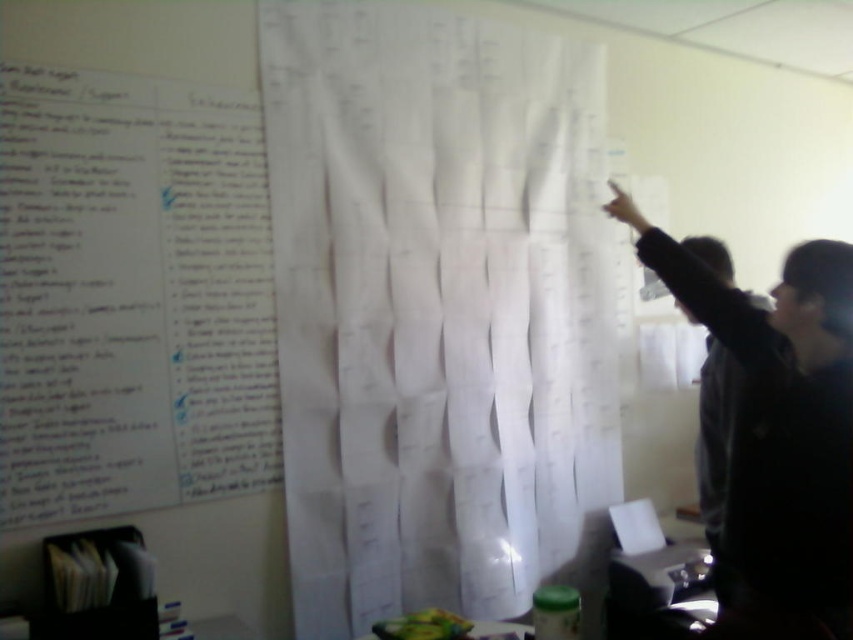
Is point (233, 284) less distant than point (770, 502)?

No, it is not.

The image size is (853, 640). I want to click on white paper at upper left, so click(x=131, y=296).

At what (x,y) coordinates should I click in order to perform the action: click on white paper at upper left. Please return your answer as a coordinate pair (x, y). Image resolution: width=853 pixels, height=640 pixels. Looking at the image, I should click on (131, 296).

Consider the image. Between white paper curtain at upper center and black fabric at upper right, which one is positioned lower?

Positioned lower is black fabric at upper right.

Between point (456, 579) and point (846, 364), which one is positioned in front?

Positioned in front is point (846, 364).

At what (x,y) coordinates should I click in order to perform the action: click on white paper curtain at upper center. Please return your answer as a coordinate pair (x, y). This screenshot has width=853, height=640. Looking at the image, I should click on (437, 310).

Is white paper curtain at upper center positioned in front of white paper at upper left?

No, it is behind white paper at upper left.

Can you confirm if white paper curtain at upper center is thinner than white paper at upper left?

Incorrect, white paper curtain at upper center's width is not less than white paper at upper left's.

Where is `white paper curtain at upper center`? The height and width of the screenshot is (640, 853). white paper curtain at upper center is located at coordinates (437, 310).